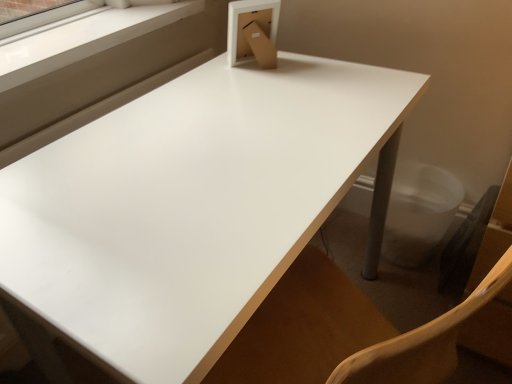
Where is `free space above white plastic window frame at upper left (from a real-world perspective)`? free space above white plastic window frame at upper left (from a real-world perspective) is located at coordinates (86, 29).